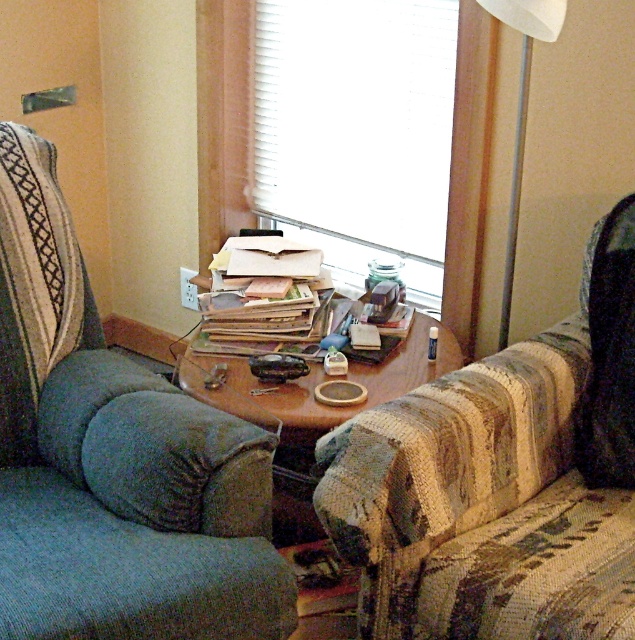
Question: Which object appears closest to the camera in this image?

Choices:
 (A) striped fabric couch at center
 (B) blue fabric swivel chair at left
 (C) wooden table at center
 (D) velvety black pillow at right

Answer: (B)

Question: Is white matte window at center above velvety black pillow at right?

Choices:
 (A) yes
 (B) no

Answer: (A)

Question: Is striped fabric couch at center smaller than white fabric lampshade at upper right?

Choices:
 (A) no
 (B) yes

Answer: (A)

Question: Which point is farther from the camera taking this photo?

Choices:
 (A) (279, 360)
 (B) (622, 438)
 (C) (364, 259)

Answer: (C)

Question: Does blue fabric swivel chair at left have a greater width compared to striped fabric couch at center?

Choices:
 (A) yes
 (B) no

Answer: (B)

Question: Which point is farther to the camera?

Choices:
 (A) (251, 364)
 (B) (243, 378)
 (C) (512, 180)

Answer: (C)